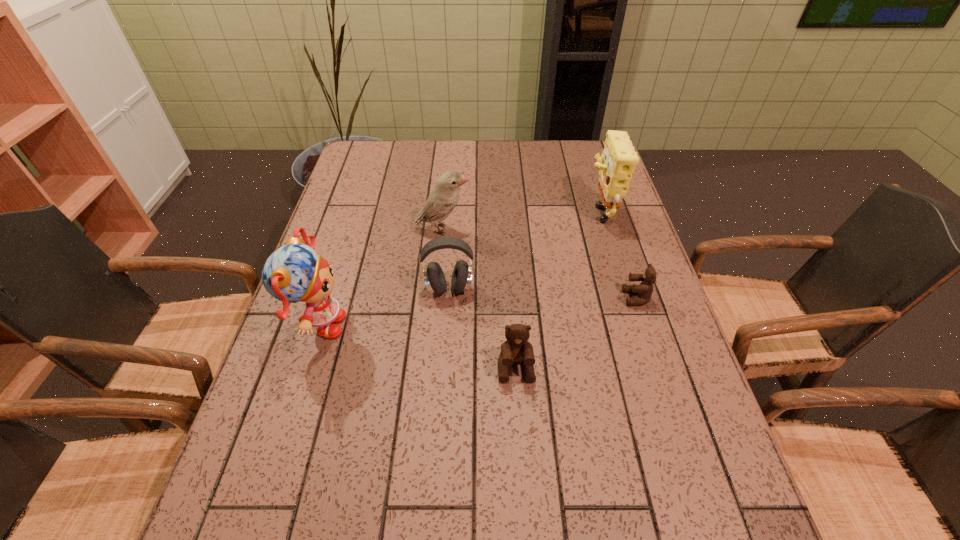
Identify the location of free location that satisfies the following two spatial constraints: 1. on the face of the farther teddy bear; 2. on the face of the second shortest object. The height and width of the screenshot is (540, 960). (660, 368).

The image size is (960, 540). I want to click on vacant area in the image that satisfies the following two spatial constraints: 1. on the ear cups of the third shortest object; 2. on the face of the leftmost object, so click(x=446, y=327).

At what (x,y) coordinates should I click in order to perform the action: click on free space that satisfies the following two spatial constraints: 1. on the face of the sponge; 2. on the ear cups of the fourth tallest object. Please return your answer as a coordinate pair (x, y). Looking at the image, I should click on (622, 289).